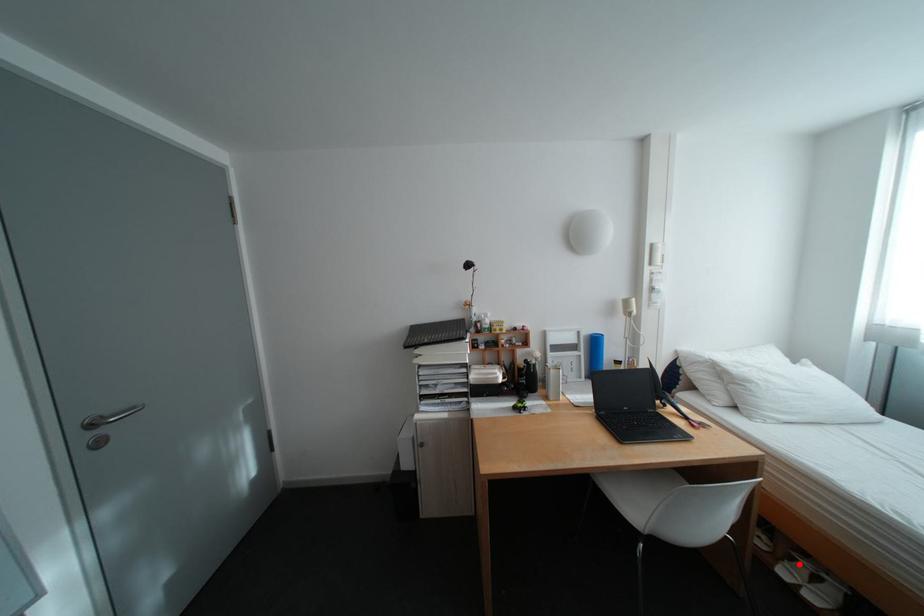
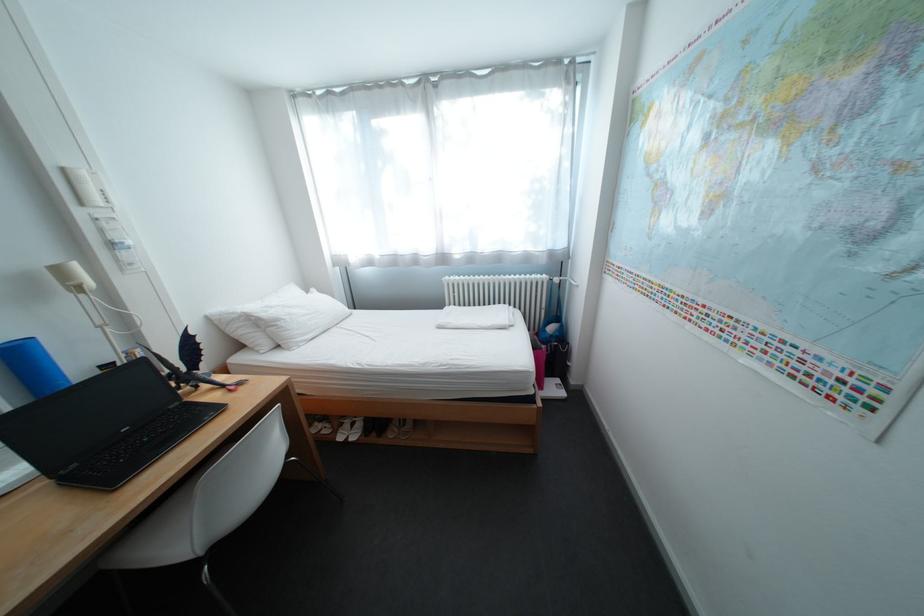
Question: I am providing you with two images of the same scene from different viewpoints. In image1, a red point is highlighted. Considering the same 3D point in image2, which of the following is correct?

Choices:
 (A) It is closer
 (B) It is farther

Answer: (B)